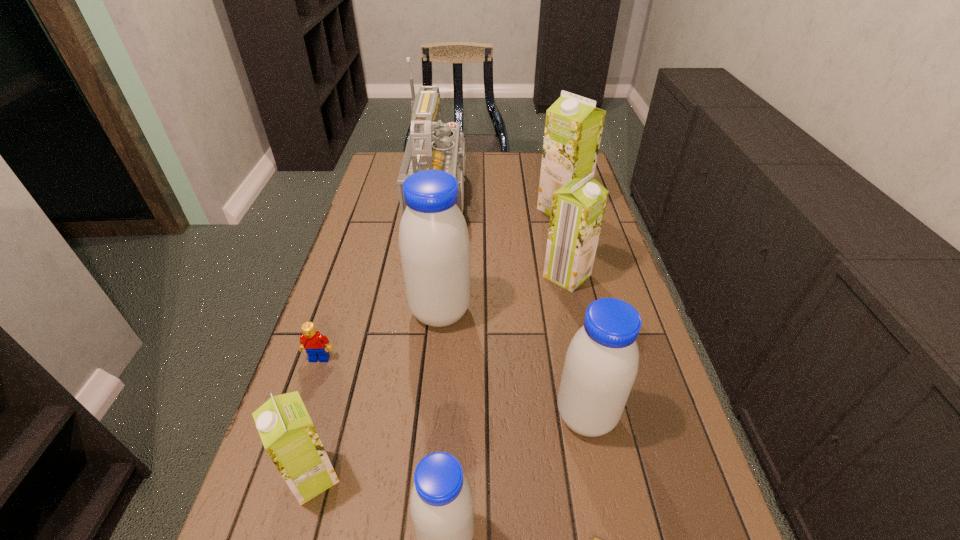
What are the coordinates of `radio receiver` in the screenshot? It's located at (431, 145).

Identify the location of the farthest green soya milk. The height and width of the screenshot is (540, 960). (573, 128).

In order to click on the biggest green soya milk in this screenshot , I will do `click(573, 128)`.

Locate an element on the screen. This screenshot has width=960, height=540. the biggest blue soya milk is located at coordinates (434, 245).

This screenshot has height=540, width=960. I want to click on the second smallest green soya milk, so click(x=577, y=211).

The height and width of the screenshot is (540, 960). What are the coordinates of `the second biggest blue soya milk` in the screenshot? It's located at (601, 364).

Image resolution: width=960 pixels, height=540 pixels. Identify the location of the fourth nearest object. (601, 364).

This screenshot has height=540, width=960. Find the location of `the smallest green soya milk`. the smallest green soya milk is located at coordinates (289, 437).

Image resolution: width=960 pixels, height=540 pixels. I want to click on the nearest green soya milk, so click(289, 437).

Image resolution: width=960 pixels, height=540 pixels. In order to click on Lego in this screenshot , I will do `click(312, 341)`.